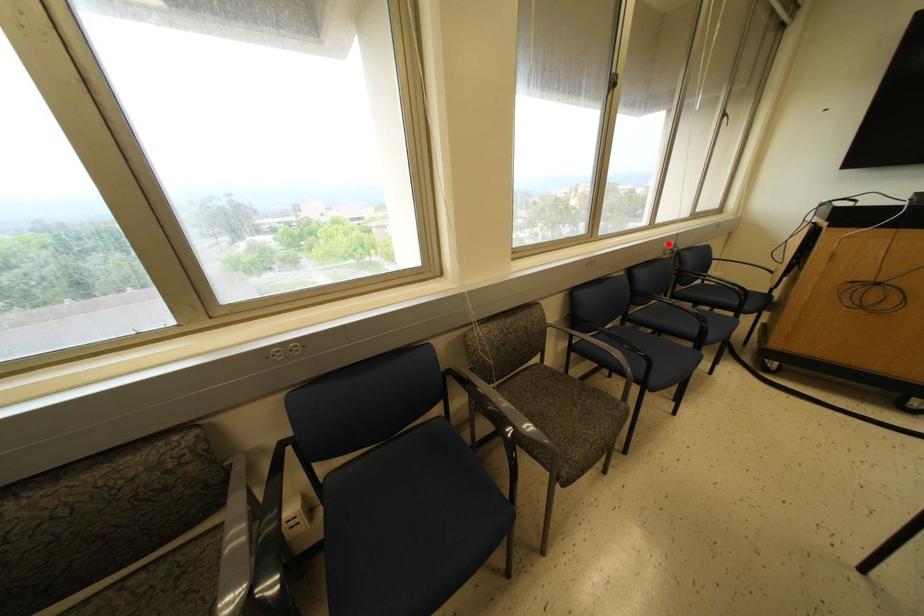
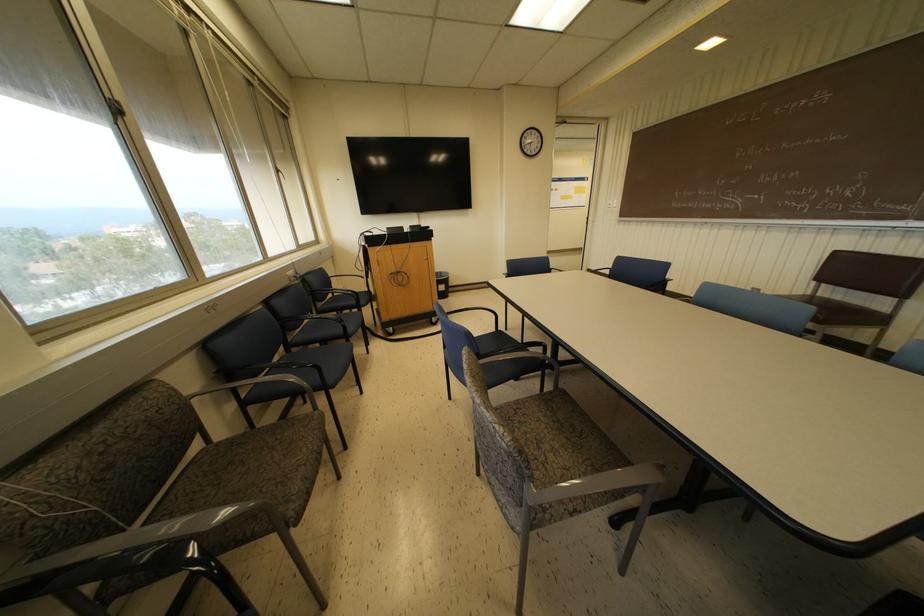
Locate, in the second image, the point that corresponds to the highlighted location in the first image.

(289, 272)